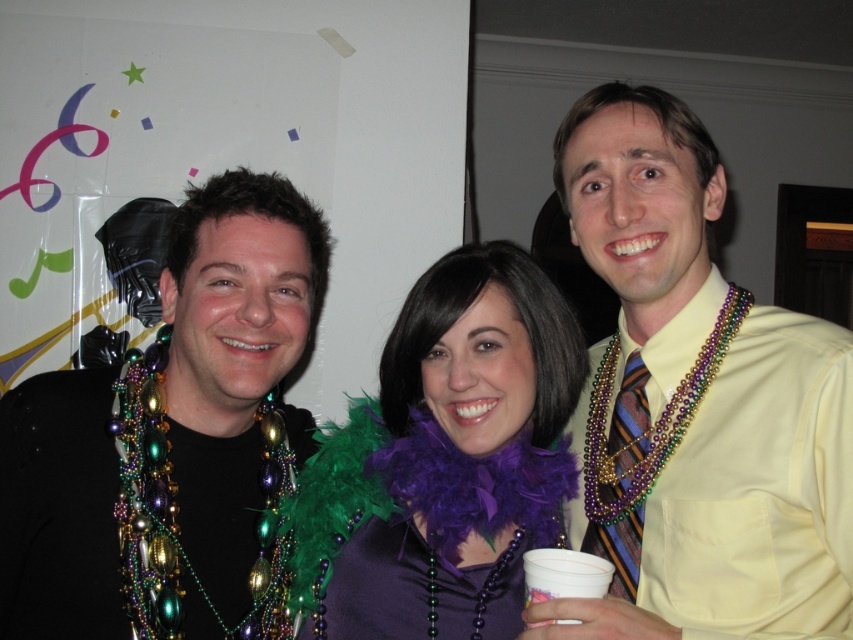
You are a photographer adjusting your camera settings to focus on the yellow satin shirt at center and the metallic beaded necklace at left. Which object should you focus on first if you want to capture both in sharp focus, considering their positions?

The yellow satin shirt at center should be focused on first because it is located above the metallic beaded necklace at left, so focusing on the higher object first ensures both are in sharp focus.

You are a photographer standing 2 meters away from the three people in the image. You want to take a closeup shot of the yellow satin shirt at center. Can you do that without moving closer?

The yellow satin shirt at center is 76.42 centimeters away from the photographer, so yes, you can take a closeup shot without moving closer as the distance is within the 2 meters.